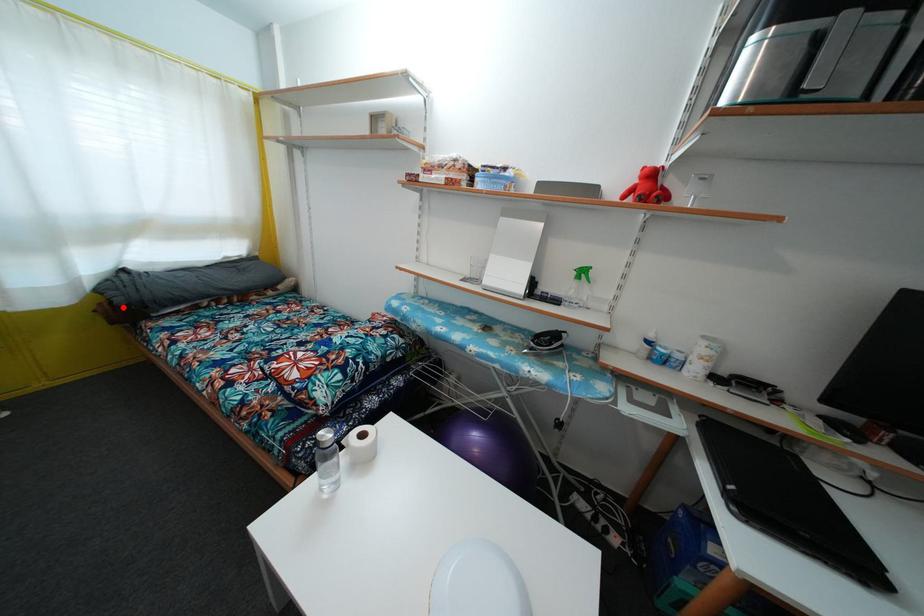
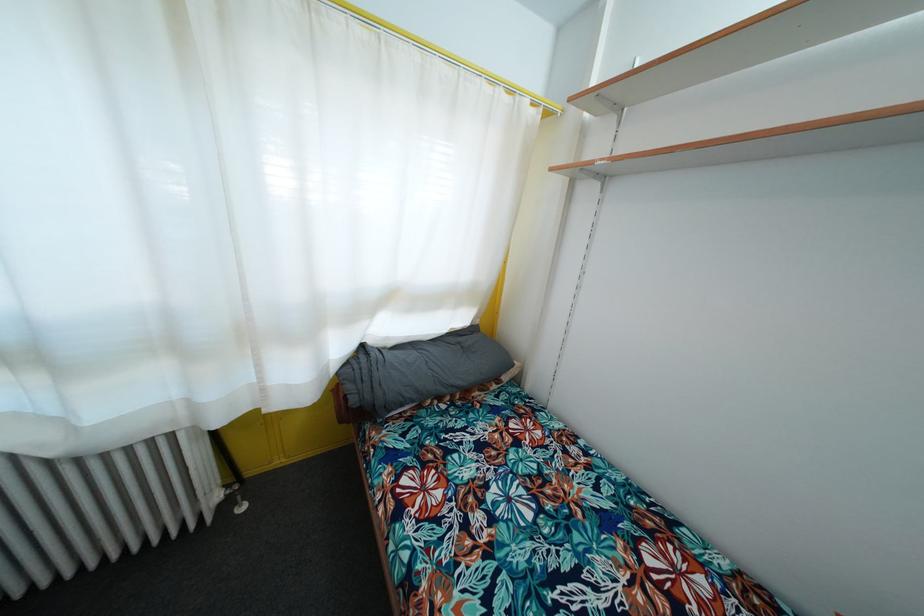
Question: I am providing you with two images of the same scene from different viewpoints. A red point is shown in image1. For the corresponding object point in image2, is it positioned nearer or farther from the camera?

Choices:
 (A) Nearer
 (B) Farther

Answer: (B)